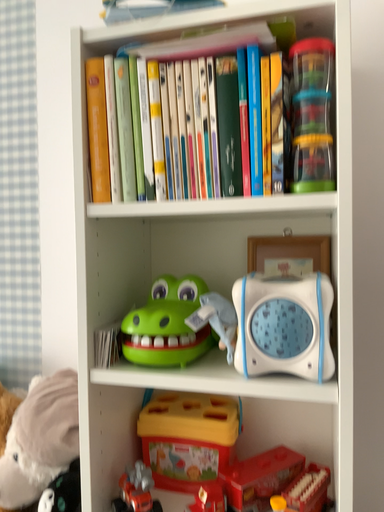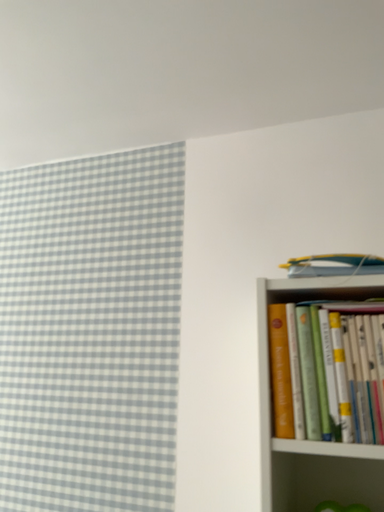
Question: How did the camera likely rotate when shooting the video?

Choices:
 (A) rotated upward
 (B) rotated downward

Answer: (A)